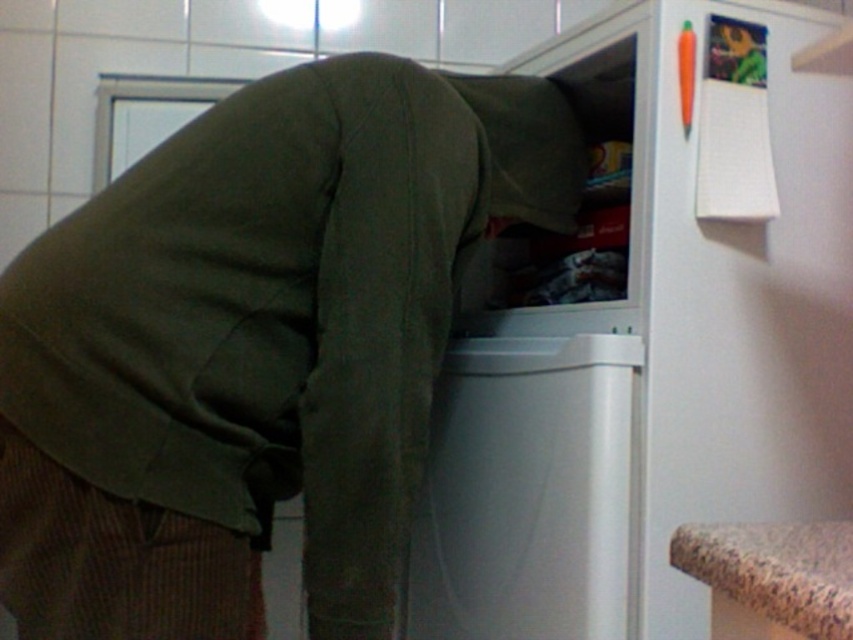
Question: Which object is the farthest from the granite countertop at lower right?

Choices:
 (A) white plastic dishwasher at center
 (B) white matte refrigerator at center

Answer: (B)

Question: Observing the image, what is the correct spatial positioning of dark green hoodie at center in reference to granite countertop at lower right?

Choices:
 (A) below
 (B) above

Answer: (B)

Question: Where is dark green hoodie at center located in relation to white plastic dishwasher at center in the image?

Choices:
 (A) above
 (B) below

Answer: (A)

Question: Which object appears closest to the camera in this image?

Choices:
 (A) white plastic dishwasher at center
 (B) granite countertop at lower right
 (C) dark green hoodie at center

Answer: (B)

Question: Does dark green hoodie at center have a lesser width compared to white matte refrigerator at center?

Choices:
 (A) yes
 (B) no

Answer: (B)

Question: Which object is farther from the camera taking this photo?

Choices:
 (A) white plastic dishwasher at center
 (B) granite countertop at lower right

Answer: (A)